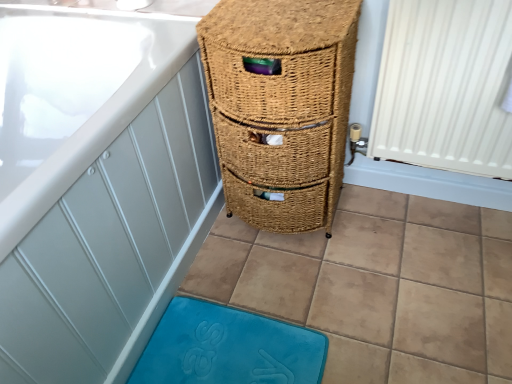
Question: From the image's perspective, is woven brown drawer at center above white ribbed radiator at right?

Choices:
 (A) yes
 (B) no

Answer: (B)

Question: Can you confirm if woven brown drawer at center is taller than white ribbed radiator at right?

Choices:
 (A) no
 (B) yes

Answer: (B)

Question: Is woven brown drawer at center shorter than white ribbed radiator at right?

Choices:
 (A) yes
 (B) no

Answer: (B)

Question: Can you confirm if woven brown drawer at center is bigger than white ribbed radiator at right?

Choices:
 (A) no
 (B) yes

Answer: (B)

Question: Does woven brown drawer at center lie in front of white ribbed radiator at right?

Choices:
 (A) no
 (B) yes

Answer: (A)

Question: Based on their positions, is woven brown drawer at center located to the left or right of white ribbed radiator at right?

Choices:
 (A) left
 (B) right

Answer: (A)

Question: In terms of size, does woven brown drawer at center appear bigger or smaller than white ribbed radiator at right?

Choices:
 (A) small
 (B) big

Answer: (B)

Question: Is woven brown drawer at center situated inside white ribbed radiator at right or outside?

Choices:
 (A) inside
 (B) outside

Answer: (B)

Question: From the image's perspective, is woven brown drawer at center located above or below white ribbed radiator at right?

Choices:
 (A) below
 (B) above

Answer: (A)

Question: From a real-world perspective, relative to woven brown drawer at center, is blue plush bath mat at lower center vertically above or below?

Choices:
 (A) above
 (B) below

Answer: (B)

Question: Is blue plush bath mat at lower center spatially inside woven brown drawer at center, or outside of it?

Choices:
 (A) outside
 (B) inside

Answer: (A)

Question: Considering the positions of point (162, 317) and point (259, 26), is point (162, 317) closer or farther from the camera than point (259, 26)?

Choices:
 (A) closer
 (B) farther

Answer: (B)

Question: Is blue plush bath mat at lower center to the left or to the right of woven brown drawer at center in the image?

Choices:
 (A) left
 (B) right

Answer: (A)

Question: In the image, is white ribbed radiator at right positioned in front of or behind blue plush bath mat at lower center?

Choices:
 (A) front
 (B) behind

Answer: (A)

Question: Considering the relative positions of white ribbed radiator at right and blue plush bath mat at lower center in the image provided, is white ribbed radiator at right to the left or to the right of blue plush bath mat at lower center?

Choices:
 (A) left
 (B) right

Answer: (B)